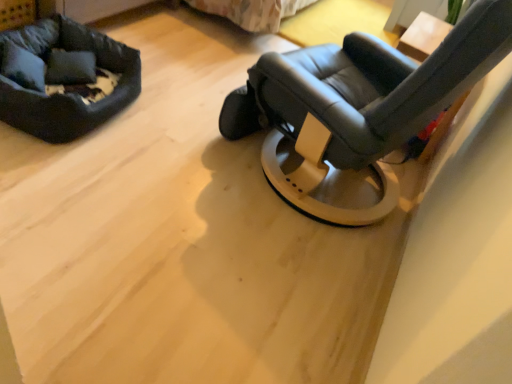
Find the location of a particular element. The height and width of the screenshot is (384, 512). free location in front of matte black chair at center is located at coordinates [231, 268].